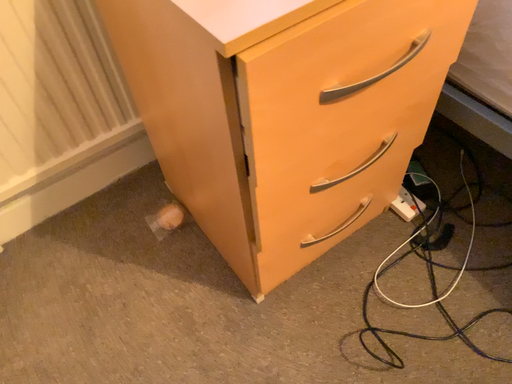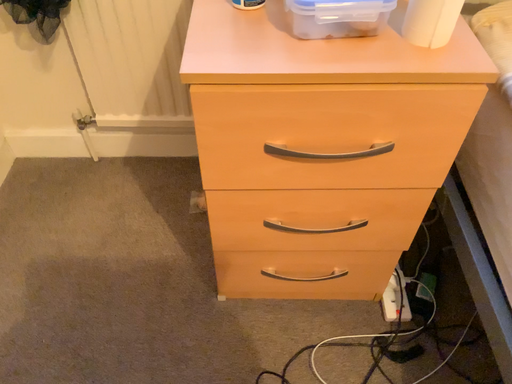
Question: Which way did the camera rotate in the video?

Choices:
 (A) rotated left
 (B) rotated right

Answer: (A)